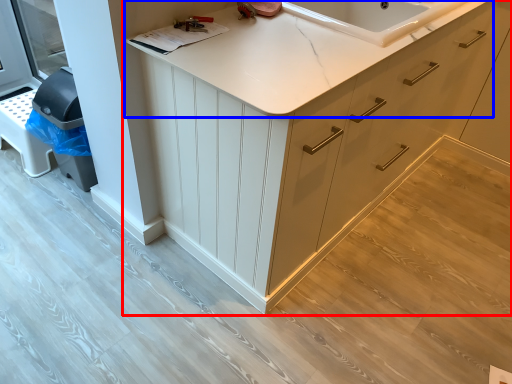
Question: Among these objects, which one is nearest to the camera, cabinetry (highlighted by a red box) or countertop (highlighted by a blue box)?

Choices:
 (A) cabinetry
 (B) countertop

Answer: (A)